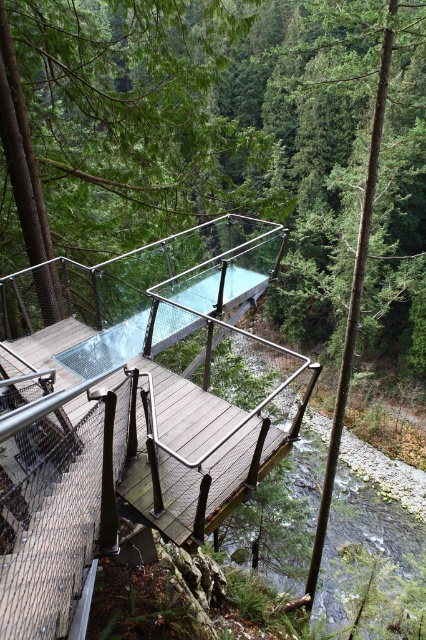
You are a maintenance worker needing to inspect the wooden bridge at center and the green matte glass at upper center. Which object is located above the other?

The green matte glass at upper center is above the wooden bridge at center because the wooden bridge at center is positioned under it.